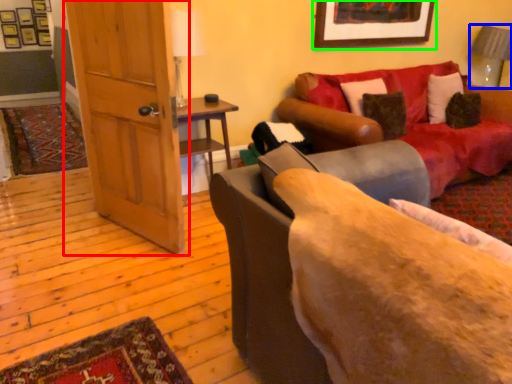
Question: Which object is the farthest from door (highlighted by a red box)? Choose among these: lamp (highlighted by a blue box) or picture frame (highlighted by a green box).

Choices:
 (A) lamp
 (B) picture frame

Answer: (A)